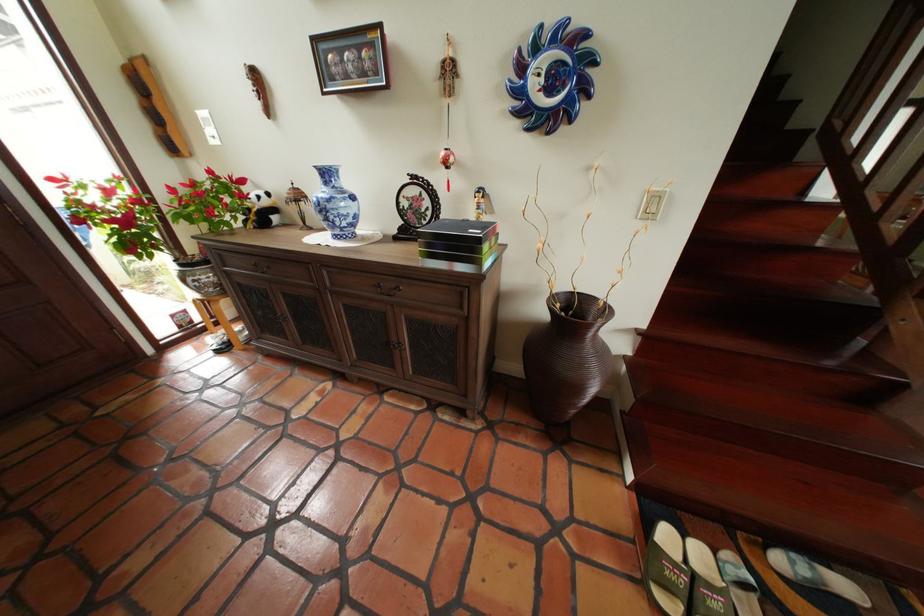
The location [457,240] corresponds to which object?

It refers to a black box.